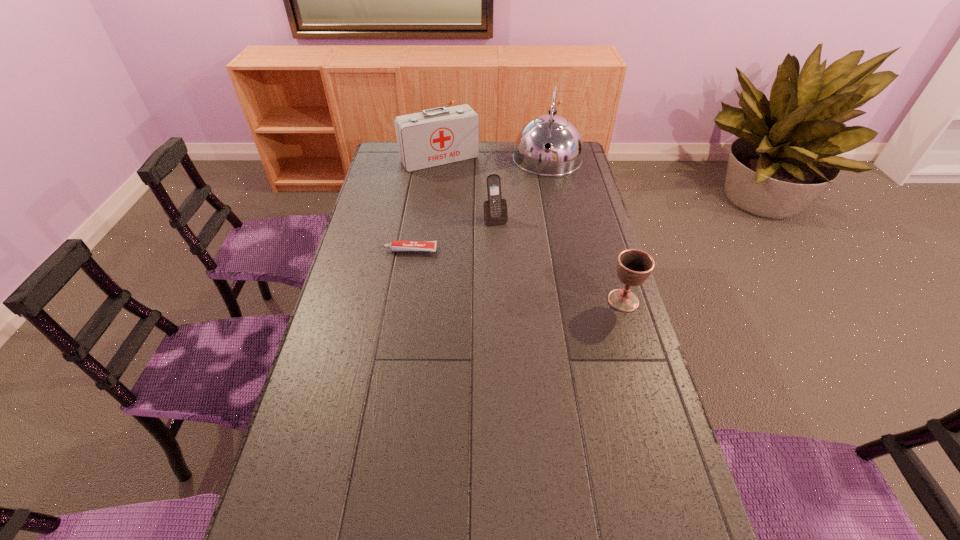
Find the location of a particular element. empty space between the toothpaste and the tallest object is located at coordinates (479, 205).

The image size is (960, 540). Find the location of `free area in between the first-aid kit and the shortest object`. free area in between the first-aid kit and the shortest object is located at coordinates (425, 205).

What are the coordinates of `unoccupied area between the shortest object and the second tallest object` in the screenshot? It's located at (425, 205).

Find the location of a particular element. This screenshot has width=960, height=540. unoccupied position between the second nearest object and the third farthest object is located at coordinates (453, 234).

The image size is (960, 540). Identify the location of vacant area that lies between the chalice and the kettle. (586, 230).

At what (x,y) coordinates should I click in order to perform the action: click on empty space that is in between the cellular telephone and the fourth farthest object. Please return your answer as a coordinate pair (x, y). The image size is (960, 540). Looking at the image, I should click on pyautogui.click(x=453, y=234).

Identify the location of vacant area that lies between the shortest object and the cellular telephone. (453, 234).

Locate an element on the screen. This screenshot has width=960, height=540. free space between the shortest object and the third farthest object is located at coordinates point(453,234).

This screenshot has width=960, height=540. I want to click on free space between the kettle and the chalice, so click(586, 230).

Identify the location of vacant area between the shortest object and the tallest object. (479, 205).